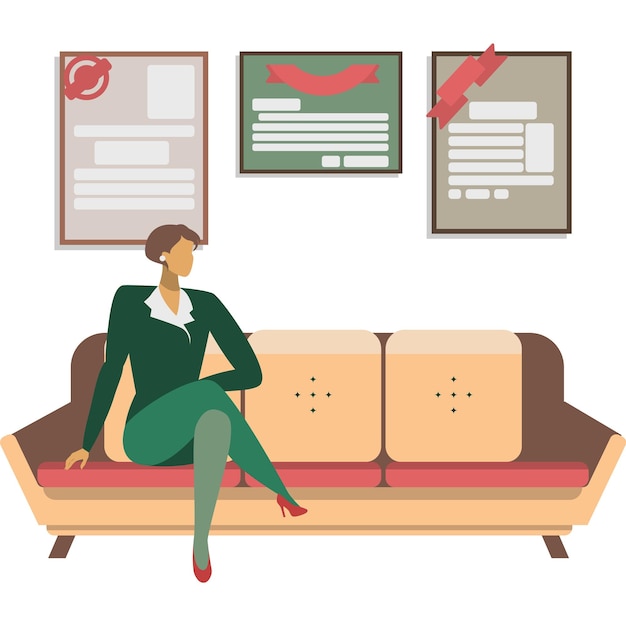
You are a GUI agent. You are given a task and a screenshot of the screen. Output one action in this format:
    pyautogui.click(x=<x>, y=<y>)
    Task: Click on the legs of the couch
    
    Given the screenshot: What is the action you would take?
    pyautogui.click(x=553, y=543), pyautogui.click(x=56, y=546)